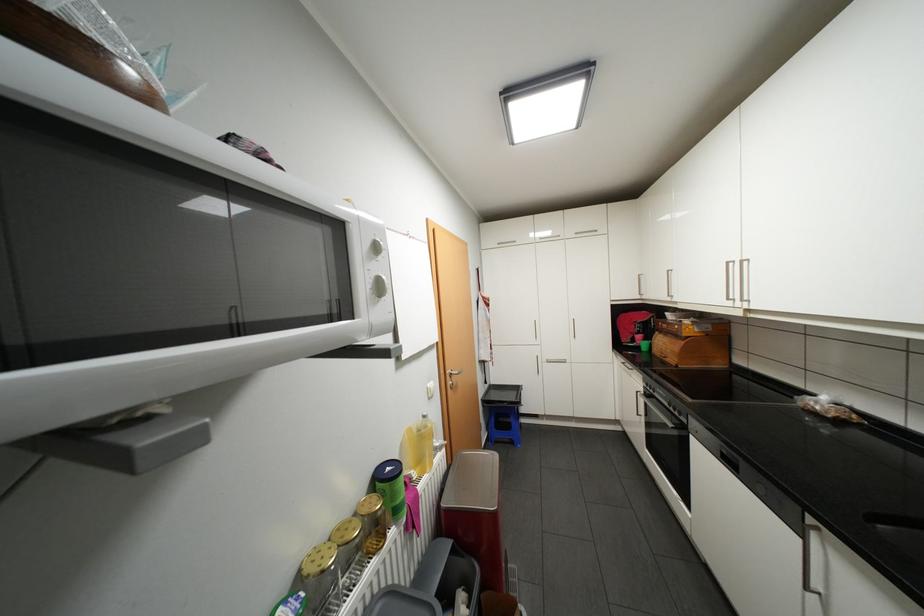
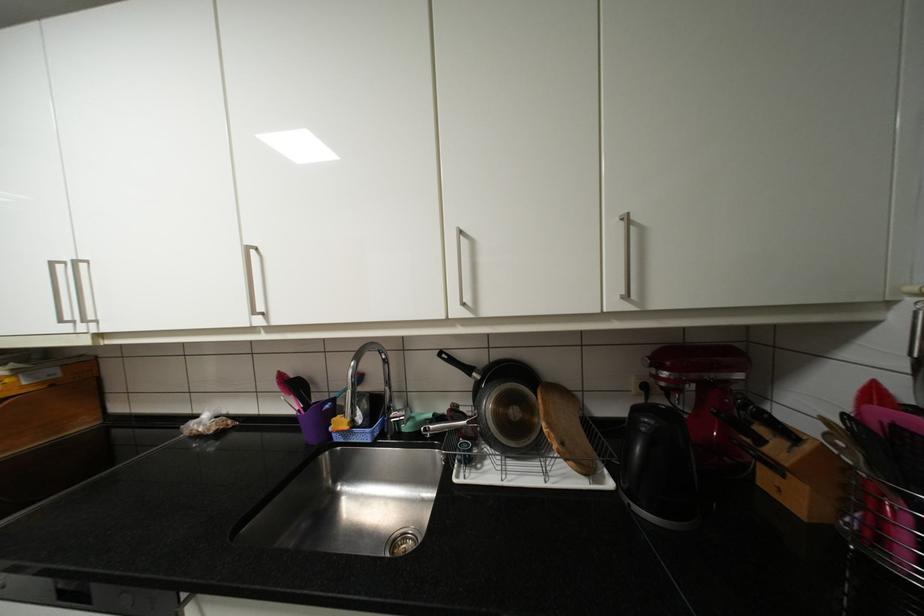
Question: Based on the continuous images, in which direction is the camera rotating? Reply with the corresponding letter.

Choices:
 (A) Left
 (B) Right
 (C) Up
 (D) Down

Answer: (B)